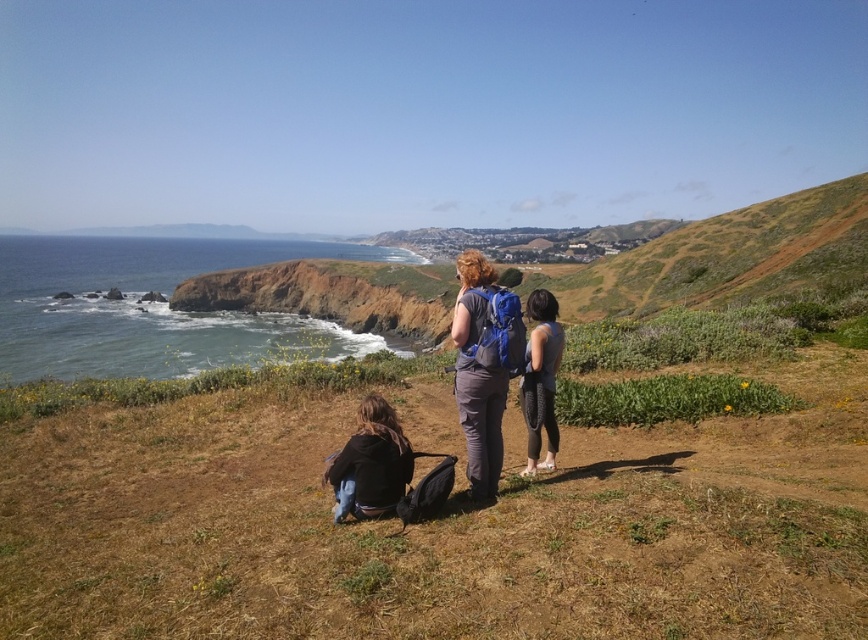
Does blue water at left appear over black mesh leggings at center?

Indeed, blue water at left is positioned over black mesh leggings at center.

Find the location of a particular element. Image resolution: width=868 pixels, height=640 pixels. blue water at left is located at coordinates (153, 307).

Which is in front, point (196, 262) or point (531, 300)?

Point (531, 300) is in front.

Identify the location of blue water at left. (153, 307).

Is point (470, 490) positioned in front of point (538, 307)?

Yes, point (470, 490) is closer to viewer.

Who is higher up, matte blue backpack at center or black mesh leggings at center?

matte blue backpack at center

Find the location of a particular element. This screenshot has width=868, height=640. matte blue backpack at center is located at coordinates (482, 368).

You are a GUI agent. You are given a task and a screenshot of the screen. Output one action in this format:
    pyautogui.click(x=<x>, y=<y>)
    Task: Click on the matte blue backpack at center
    
    Given the screenshot: What is the action you would take?
    [482, 368]

At what (x,y) coordinates should I click in order to perform the action: click on blue water at left. Please return your answer as a coordinate pair (x, y). This screenshot has width=868, height=640. Looking at the image, I should click on (153, 307).

Between blue water at left and matte blue backpack at center, which one appears on the left side from the viewer's perspective?

blue water at left is more to the left.

Is point (87, 269) positioned in front of point (481, 376)?

No, it is not.

Locate an element on the screen. Image resolution: width=868 pixels, height=640 pixels. blue water at left is located at coordinates (153, 307).